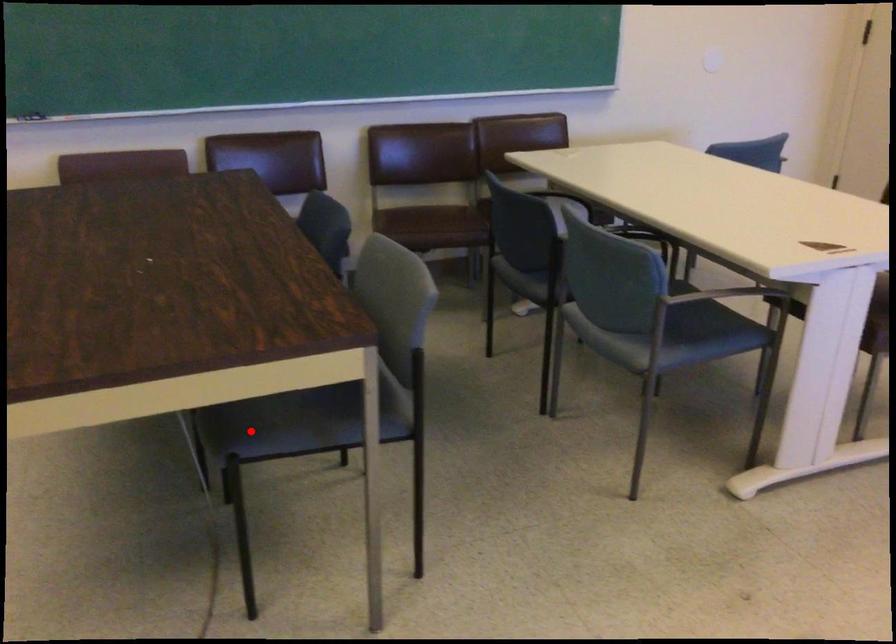
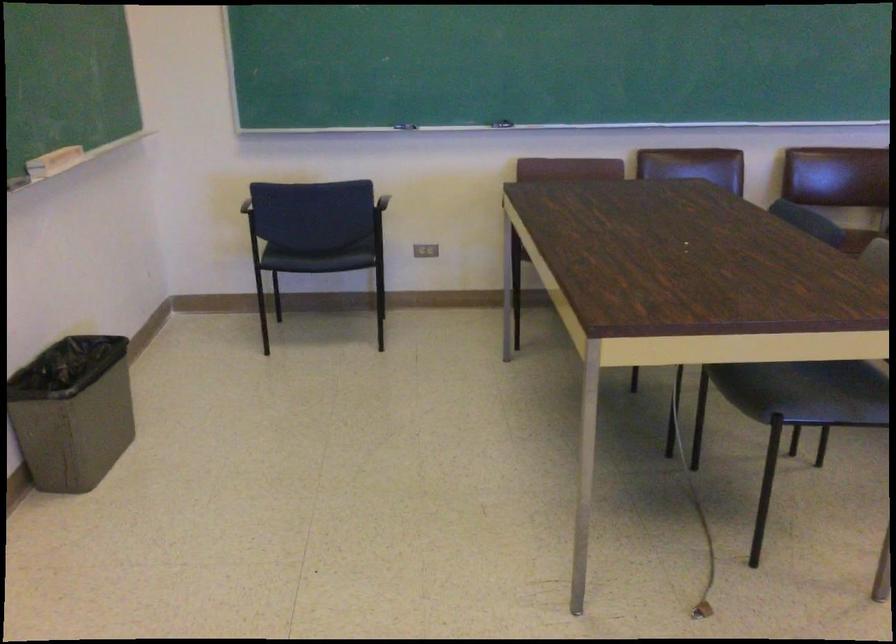
Question: I am providing you with two images of the same scene from different viewpoints. Given a red point in image1, look at the same physical point in image2. Is it:

Choices:
 (A) Closer to the viewpoint
 (B) Farther from the viewpoint

Answer: (B)